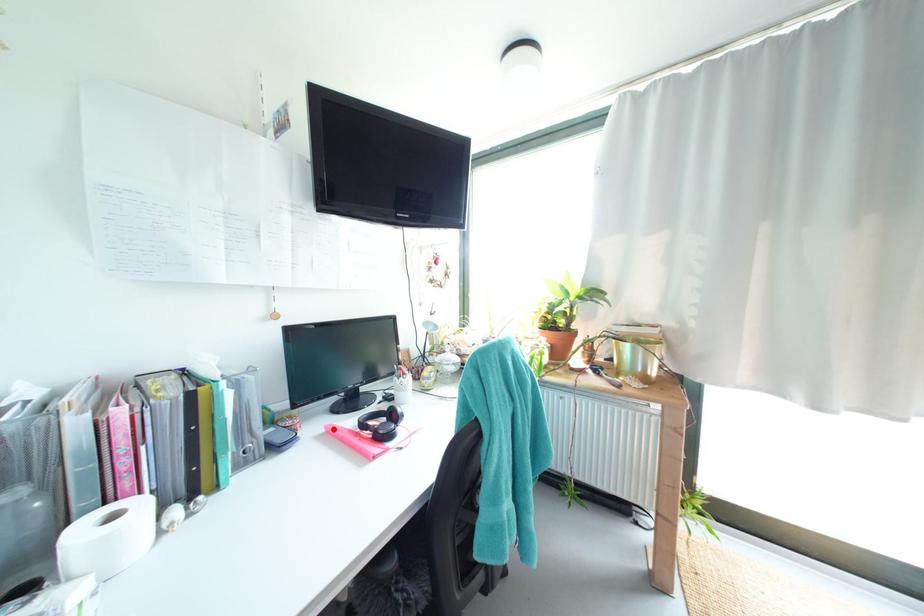
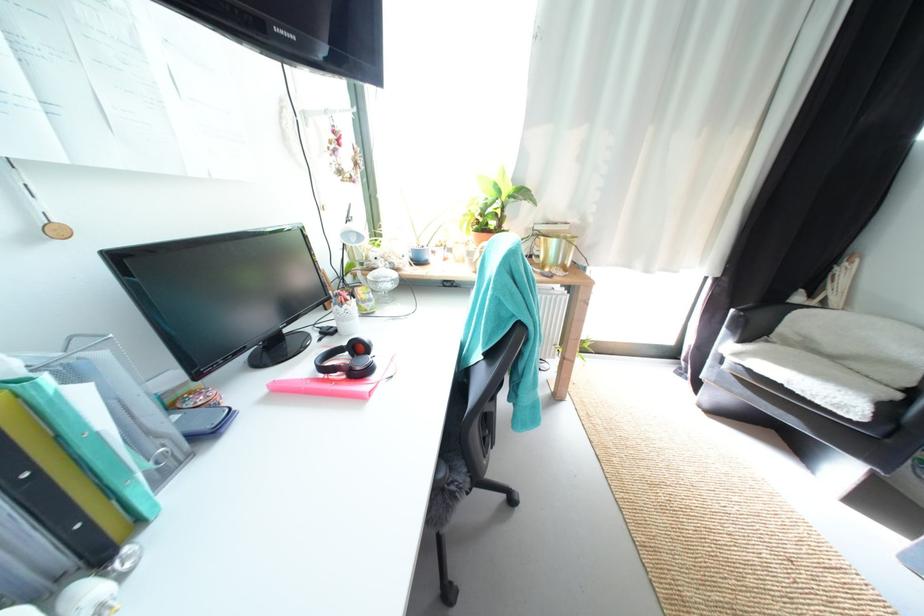
In the second image, find the point that corresponds to the highlighted location in the first image.

(275, 387)